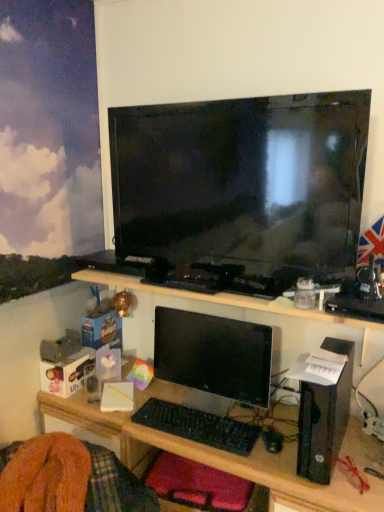
Find the location of `free spot in front of black plastic computer at right`. free spot in front of black plastic computer at right is located at coordinates (345, 479).